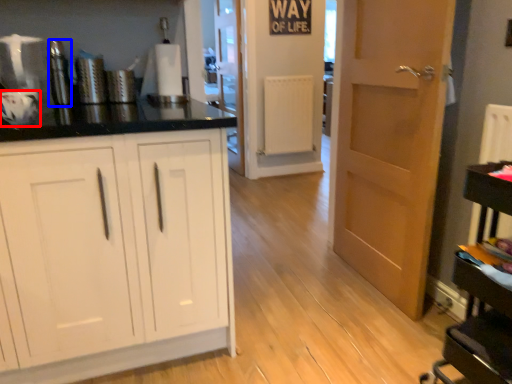
Question: Among these objects, which one is nearest to the camera, appliance (highlighted by a red box) or appliance (highlighted by a blue box)?

Choices:
 (A) appliance
 (B) appliance

Answer: (A)